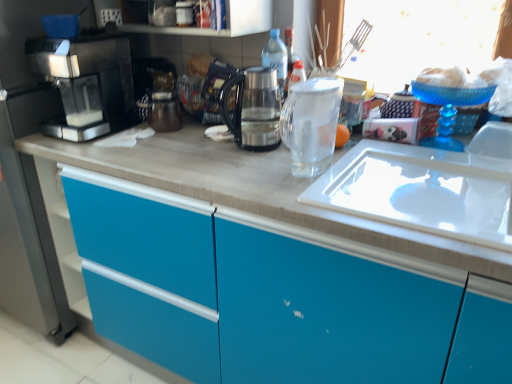
Question: Is metallic black coffee maker at center inside the boundaries of sleek black coffee machine at left, or outside?

Choices:
 (A) outside
 (B) inside

Answer: (A)

Question: From a real-world perspective, relative to sleek black coffee machine at left, is metallic black coffee maker at center vertically above or below?

Choices:
 (A) below
 (B) above

Answer: (A)

Question: Estimate the real-world distances between objects in this image. Which object is farther from the metallic black coffee maker at center?

Choices:
 (A) matte white countertop at center
 (B) transparent glass coffee pot at center, placed as the first kitchen appliance when sorted from left to right
 (C) sleek black coffee machine at left
 (D) transparent glass at center
 (E) clear glass pitcher at center, the 2th kitchen appliance in the left-to-right sequence

Answer: (D)

Question: Which of these objects is positioned farthest from the clear glass pitcher at center, the first kitchen appliance when ordered from right to left?

Choices:
 (A) matte white countertop at center
 (B) transparent glass coffee pot at center, placed as the first kitchen appliance when sorted from left to right
 (C) transparent glass at center
 (D) metallic black coffee maker at center
 (E) white glossy sink at center right

Answer: (D)